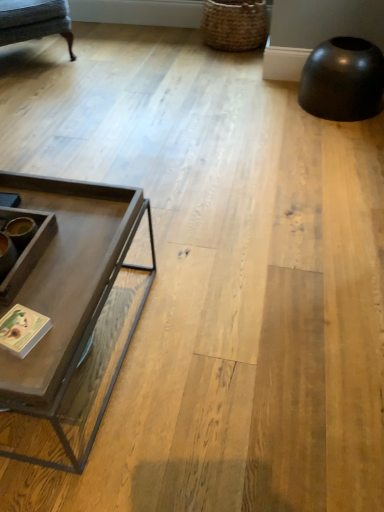
At what (x,y) coordinates should I click in order to perform the action: click on free location to the right of textured gray fabric swivel chair at upper left. Please return your answer as a coordinate pair (x, y). Looking at the image, I should click on (112, 56).